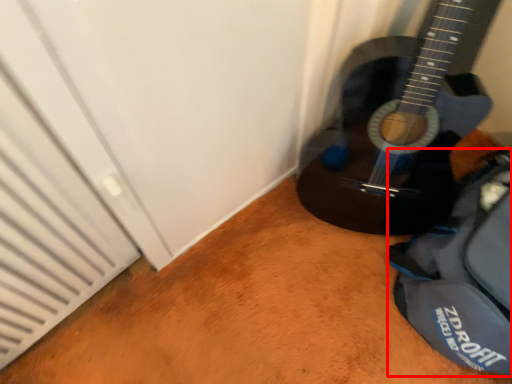
Question: From the image's perspective, what is the correct spatial relationship of messenger bag (annotated by the red box) in relation to guitar?

Choices:
 (A) above
 (B) below

Answer: (B)